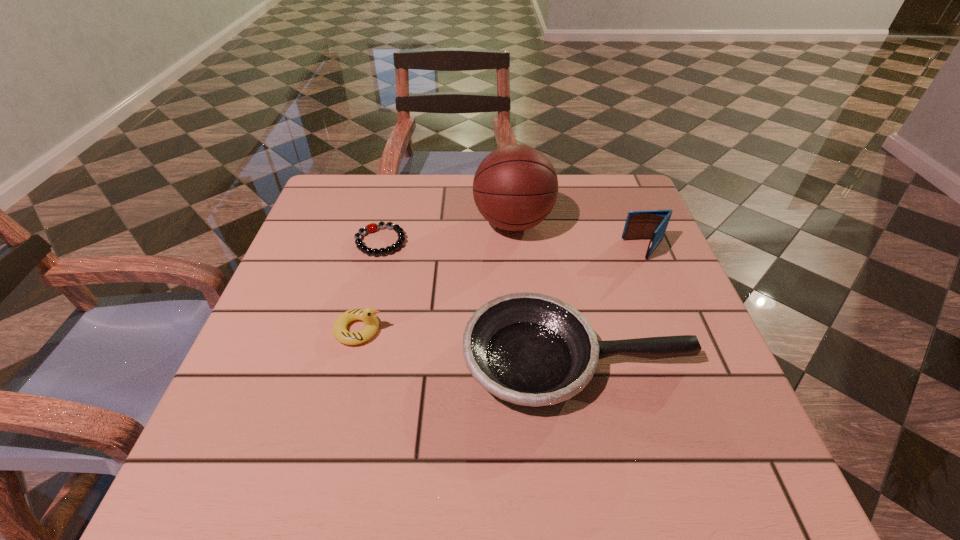
At what (x,y) coordinates should I click in order to perform the action: click on free point at the left edge. Please return your answer as a coordinate pair (x, y). Looking at the image, I should click on (269, 331).

In order to click on vacant region at the right edge of the desktop in this screenshot , I will do click(x=692, y=304).

The height and width of the screenshot is (540, 960). I want to click on vacant space at the far left corner of the desktop, so click(x=321, y=210).

In the image, there is a desktop. Where is `vacant region at the near left corner`? The width and height of the screenshot is (960, 540). vacant region at the near left corner is located at coordinates (197, 475).

Where is `blank space at the far right corner`? blank space at the far right corner is located at coordinates (614, 221).

Where is `blank region between the fourth shortest object and the shortest object`? blank region between the fourth shortest object and the shortest object is located at coordinates (514, 245).

Image resolution: width=960 pixels, height=540 pixels. I want to click on unoccupied area between the shortest object and the duckling, so click(x=370, y=286).

The image size is (960, 540). Find the location of `free space between the duckling and the shortest object`. free space between the duckling and the shortest object is located at coordinates point(370,286).

You are a GUI agent. You are given a task and a screenshot of the screen. Output one action in this format:
    pyautogui.click(x=<x>, y=<y>)
    Task: Click on the empty space between the tallest object and the bracelet
    
    Given the screenshot: What is the action you would take?
    pyautogui.click(x=446, y=232)

Locate an element on the screen. The image size is (960, 540). free spot between the tallest object and the frying pan is located at coordinates (546, 291).